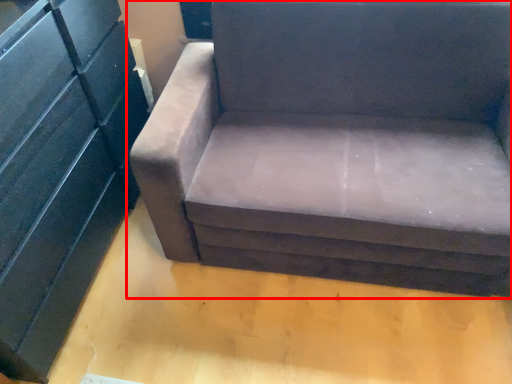
Question: From the image's perspective, where is studio couch (annotated by the red box) located in relation to dresser in the image?

Choices:
 (A) above
 (B) below

Answer: (A)